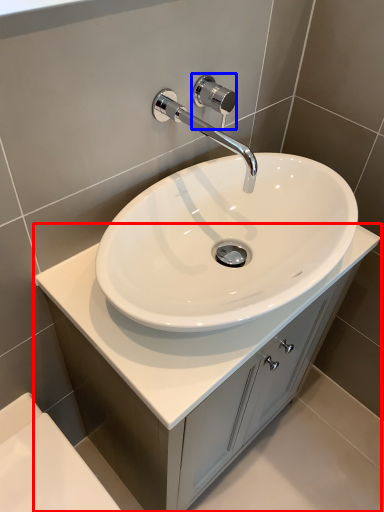
Question: Which object is closer to the camera taking this photo, bathroom cabinet (highlighted by a red box) or shower (highlighted by a blue box)?

Choices:
 (A) bathroom cabinet
 (B) shower

Answer: (A)